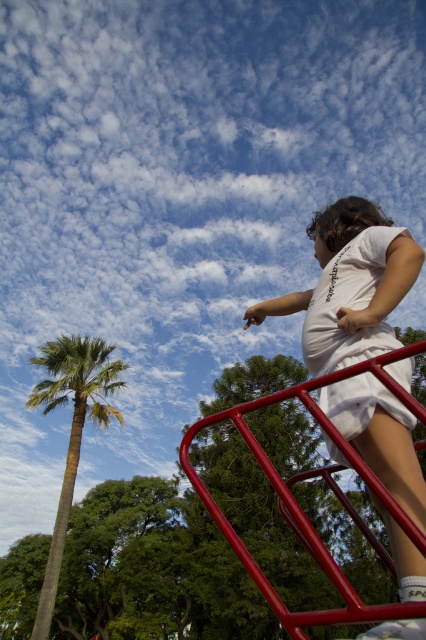
Question: Which point is farther to the camera?

Choices:
 (A) green leafy palm at left
 (B) white cotton shirt at upper right

Answer: (A)

Question: Can you confirm if white cotton shirt at upper right is bigger than white cotton dress at upper right?

Choices:
 (A) yes
 (B) no

Answer: (A)

Question: Which point is closer to the camera?

Choices:
 (A) white cotton dress at upper right
 (B) green leafy palm at left
 (C) white cotton shirt at upper right

Answer: (C)

Question: Observing the image, what is the correct spatial positioning of white cotton shirt at upper right in reference to green leafy palm at left?

Choices:
 (A) right
 (B) left

Answer: (A)

Question: Is white cotton dress at upper right bigger than green leafy palm at left?

Choices:
 (A) yes
 (B) no

Answer: (B)

Question: Which object is farther from the camera taking this photo?

Choices:
 (A) white cotton shirt at upper right
 (B) white cotton dress at upper right

Answer: (B)